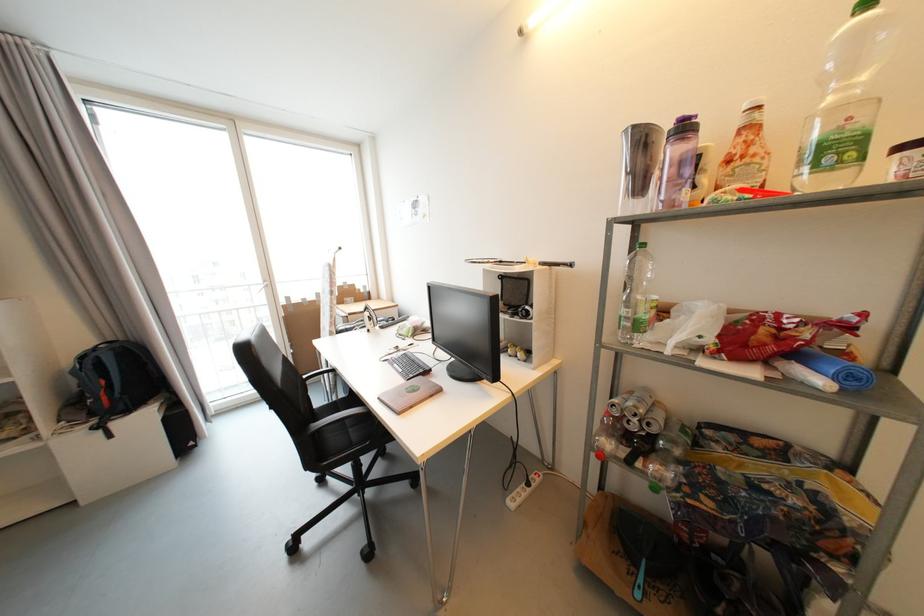
Locate an element on the screen. black computer keyboard is located at coordinates (408, 365).